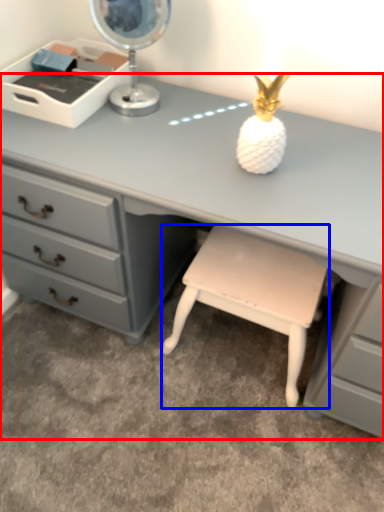
Question: Which of the following is the closest to the observer, desk (highlighted by a red box) or stool (highlighted by a blue box)?

Choices:
 (A) desk
 (B) stool

Answer: (A)